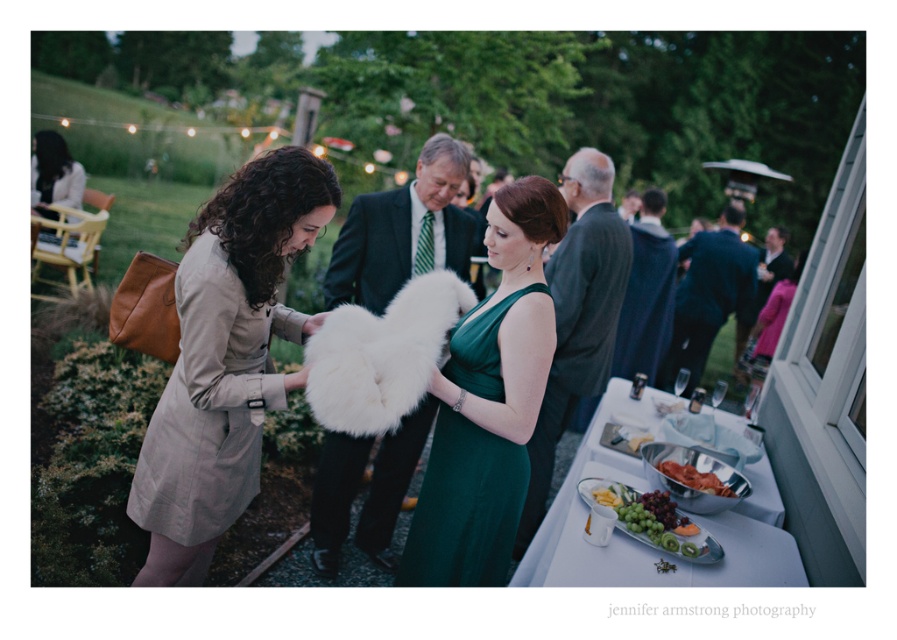
You are a photographer at the event and need to position a backdrop between the dark gray suit at center and the smooth white cheese at lower center. Which object should be placed closer to the backdrop to ensure both are visible without overlapping?

The dark gray suit at center has a greater width than the smooth white cheese at lower center. To prevent overlapping, the wider dark gray suit at center should be placed closer to the backdrop so that both objects can be accommodated within the frame.

You are a photographer at the event and want to capture both the dark gray suit at center and the white fluffy fur at center in a single frame. Since the camera has a limited focus range, which object should you prioritize to ensure it stays in focus if you can only focus on one?

The dark gray suit at center is larger in size than the white fluffy fur at center, so you should prioritize focusing on the dark gray suit at center to ensure it stays in focus.